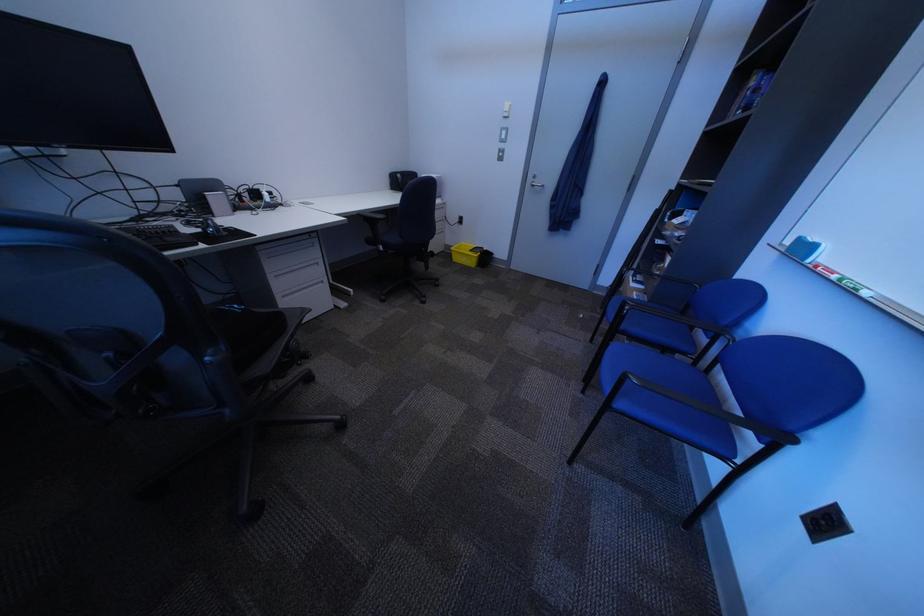
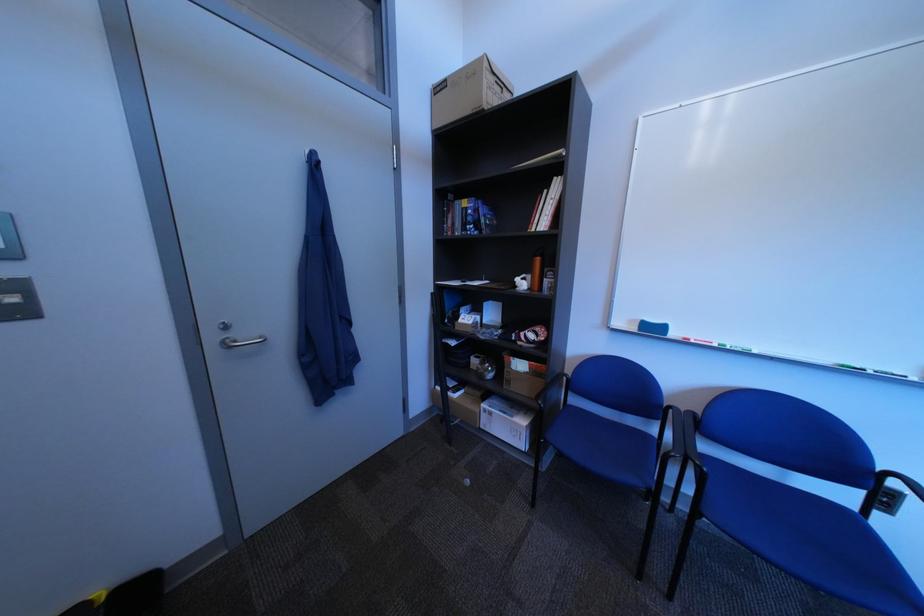
Find the pixel in the second image that matches pixel 849 278 in the first image.

(732, 347)